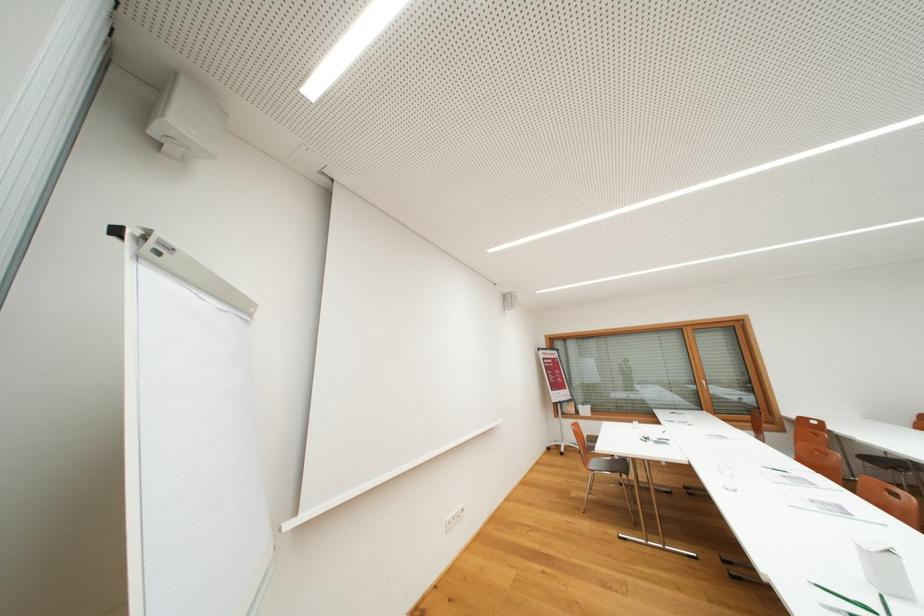
Identify the location of flipchart paper clamp. (187, 121).